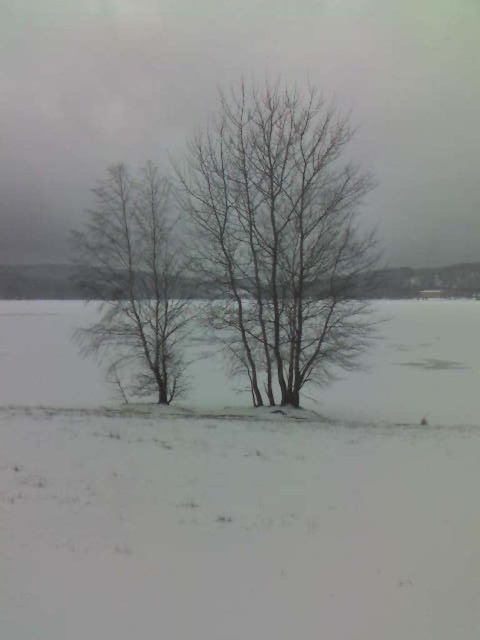
Who is more distant from viewer, [219,426] or [276,340]?

The point [276,340] is more distant.

Who is taller, white powdery snow at center or bare branches at center?

white powdery snow at center

Is point (322, 618) farther from camera compared to point (255, 342)?

That is False.

Identify the location of white powdery snow at center. This screenshot has height=640, width=480. (260, 509).

Does bare branches at center lie in front of bare branches at left?

Yes, bare branches at center is closer to the viewer.

How far apart are bare branches at center and bare branches at left?

bare branches at center and bare branches at left are 5.52 meters apart.

Is point (299, 401) in front of point (139, 362)?

That is True.

Identify the location of bare branches at center. Image resolution: width=480 pixels, height=640 pixels. (278, 237).

Who is higher up, white powdery snow at center or bare branches at left?

bare branches at left is above.

Locate an element on the screen. white powdery snow at center is located at coordinates (260, 509).

Who is more distant from viewer, (336,486) or (124,212)?

Point (124,212)

Where is `white powdery snow at center`? white powdery snow at center is located at coordinates point(260,509).